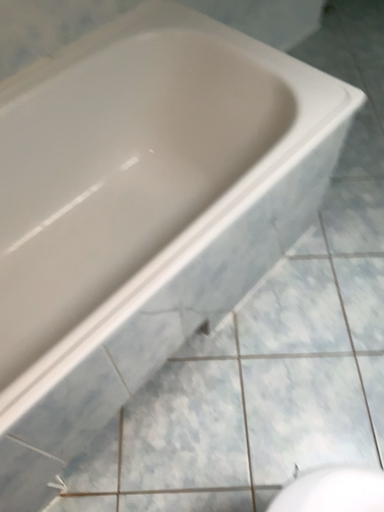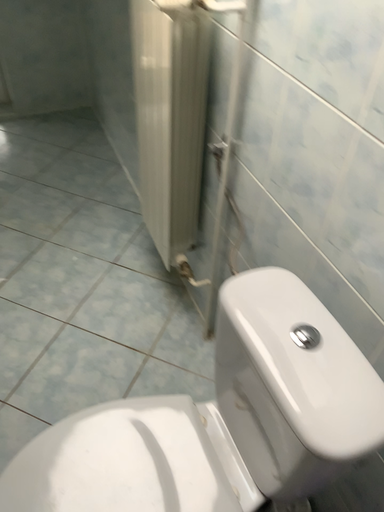
Question: How did the camera likely rotate when shooting the video?

Choices:
 (A) rotated left
 (B) rotated right

Answer: (B)